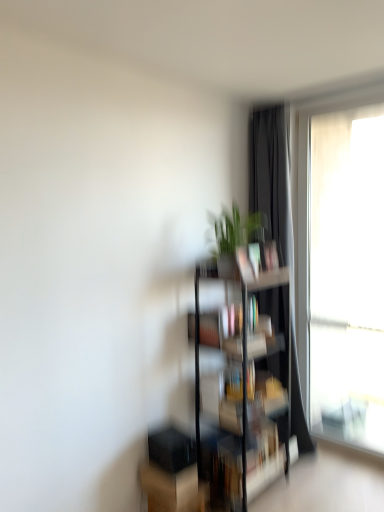
Locate an element on the screen. free space between clear glass bookshelf at center and black matte curtain at right is located at coordinates (296, 493).